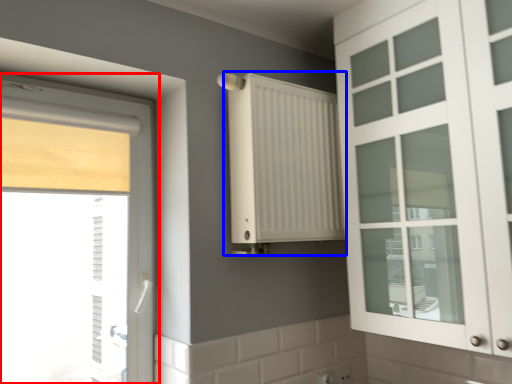
Question: Which object is further to the camera taking this photo, window (highlighted by a red box) or radiator (highlighted by a blue box)?

Choices:
 (A) window
 (B) radiator

Answer: (B)